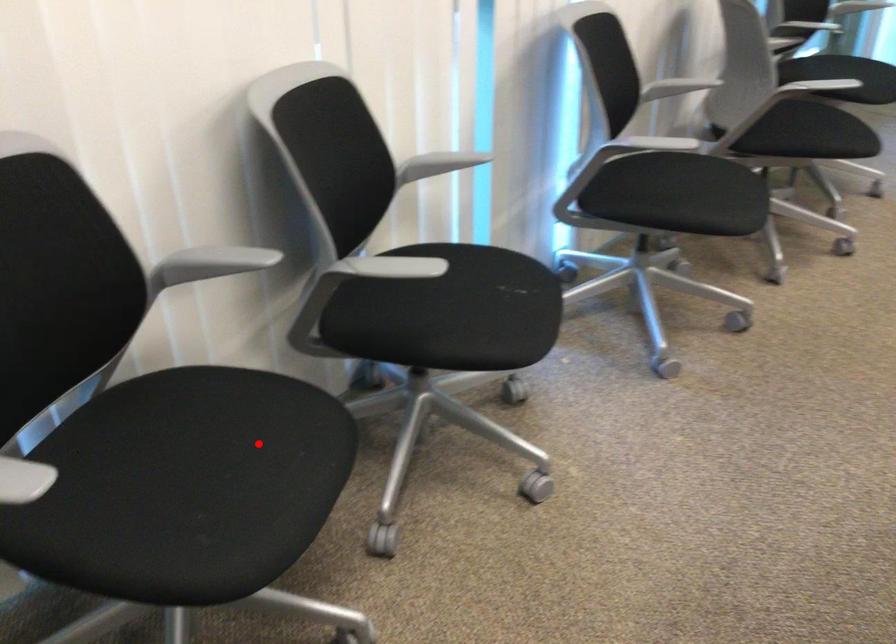
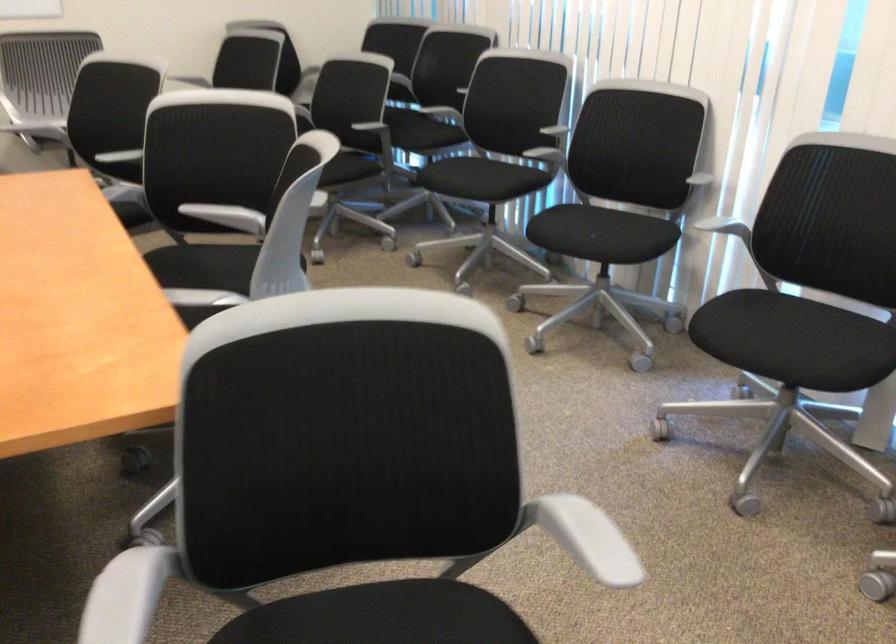
Question: A red point is marked in image1. In image2, is the corresponding 3D point closer to the camera or farther? Reply with the corresponding letter.

Choices:
 (A) The corresponding 3D point is closer.
 (B) The corresponding 3D point is farther.

Answer: (B)